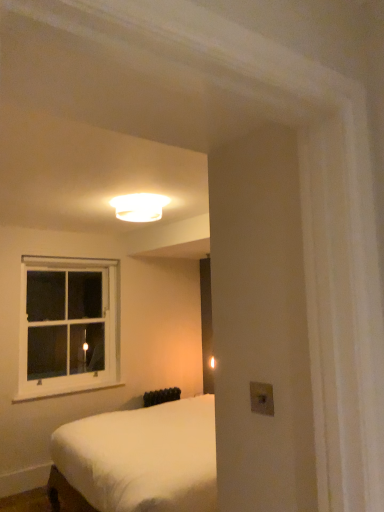
Question: Is white painted wood at lower left not inside white glossy ceiling light at upper center?

Choices:
 (A) no
 (B) yes

Answer: (B)

Question: Is white painted wood at lower left to the left of white glossy ceiling light at upper center from the viewer's perspective?

Choices:
 (A) yes
 (B) no

Answer: (A)

Question: Is white painted wood at lower left bigger than white glossy ceiling light at upper center?

Choices:
 (A) yes
 (B) no

Answer: (B)

Question: From a real-world perspective, is white painted wood at lower left below white glossy ceiling light at upper center?

Choices:
 (A) no
 (B) yes

Answer: (B)

Question: Considering the relative positions of white painted wood at lower left and white glossy ceiling light at upper center in the image provided, is white painted wood at lower left behind white glossy ceiling light at upper center?

Choices:
 (A) no
 (B) yes

Answer: (B)

Question: Considering the positions of white painted wood at lower left and white wooden window at upper left in the image, is white painted wood at lower left bigger or smaller than white wooden window at upper left?

Choices:
 (A) big
 (B) small

Answer: (B)

Question: In terms of width, does white painted wood at lower left look wider or thinner when compared to white wooden window at upper left?

Choices:
 (A) thin
 (B) wide

Answer: (A)

Question: Is point (31, 399) positioned closer to the camera than point (56, 293)?

Choices:
 (A) farther
 (B) closer

Answer: (B)

Question: From a real-world perspective, relative to white wooden window at upper left, is white painted wood at lower left vertically above or below?

Choices:
 (A) above
 (B) below

Answer: (B)

Question: Considering the positions of black matte radiator at lower center and white wooden window at upper left in the image, is black matte radiator at lower center wider or thinner than white wooden window at upper left?

Choices:
 (A) wide
 (B) thin

Answer: (B)

Question: From the image's perspective, is black matte radiator at lower center above or below white wooden window at upper left?

Choices:
 (A) above
 (B) below

Answer: (B)

Question: From a real-world perspective, is black matte radiator at lower center physically located above or below white wooden window at upper left?

Choices:
 (A) above
 (B) below

Answer: (B)

Question: Is black matte radiator at lower center to the left or to the right of white wooden window at upper left in the image?

Choices:
 (A) left
 (B) right

Answer: (B)

Question: In the image, is white painted wood at lower left on the left side or the right side of black matte radiator at lower center?

Choices:
 (A) right
 (B) left

Answer: (B)

Question: Is white painted wood at lower left taller or shorter than black matte radiator at lower center?

Choices:
 (A) short
 (B) tall

Answer: (A)